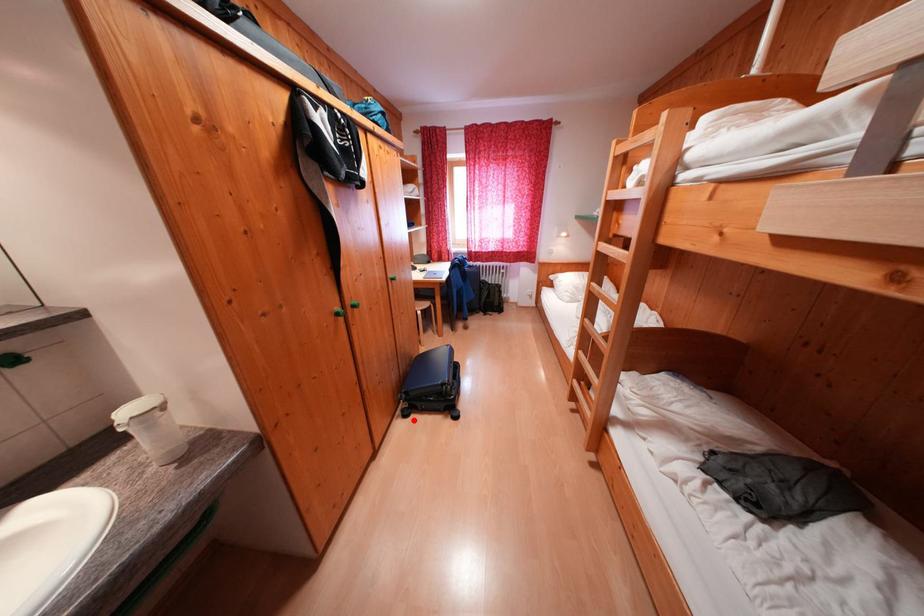
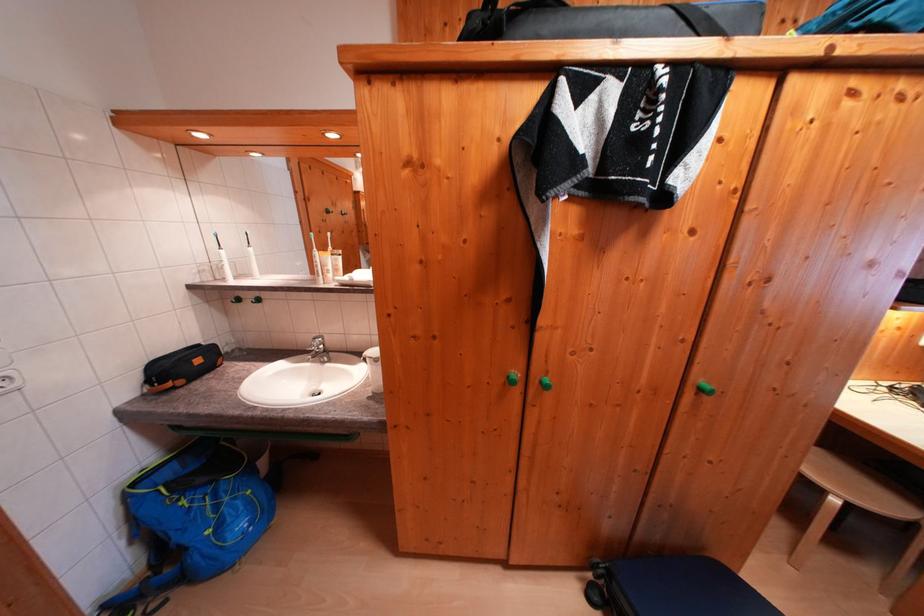
The point at the highlighted location is marked in the first image. Where is the corresponding point in the second image?

(598, 602)